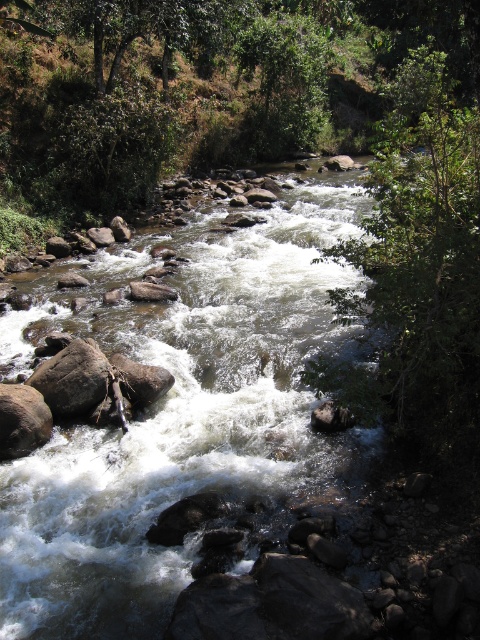
You are standing at the edge of the river and see a point marked at coordinates (177, 408). According to the image, where is this point located?

The point is located on the brown rocky stream at center.

You are a hiker trying to cross the river. You see the brown rocky stream at center and the green leafy tree at upper center. Which object is taller?

The green leafy tree at upper center is taller than the brown rocky stream at center.

You are a bird flying over the river scene. You want to land on the tallest tree to rest. Which tree should you choose between the green leafy tree at upper right and the green leafy tree at upper center?

The green leafy tree at upper right has a larger size compared to the green leafy tree at upper center, so you should choose the green leafy tree at upper right to land on.